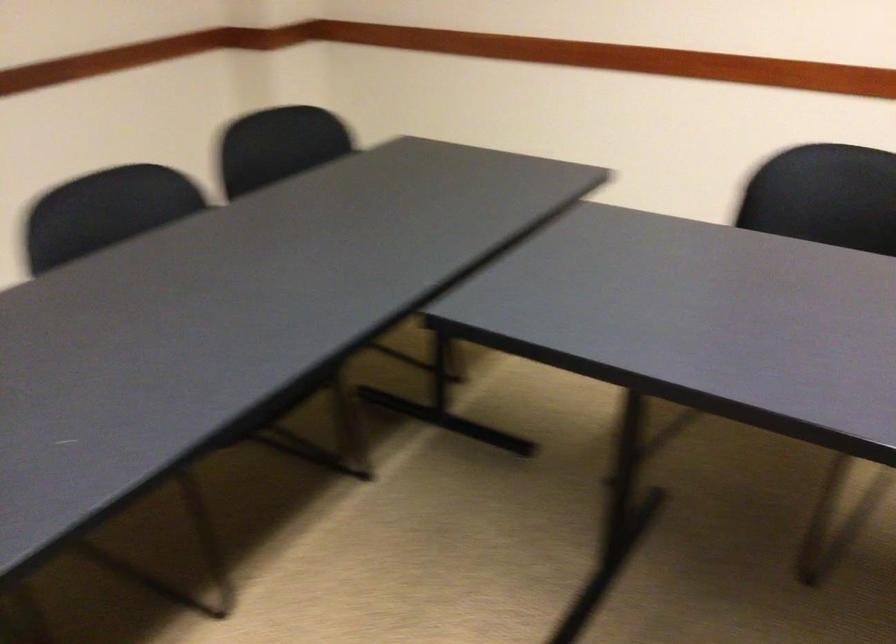
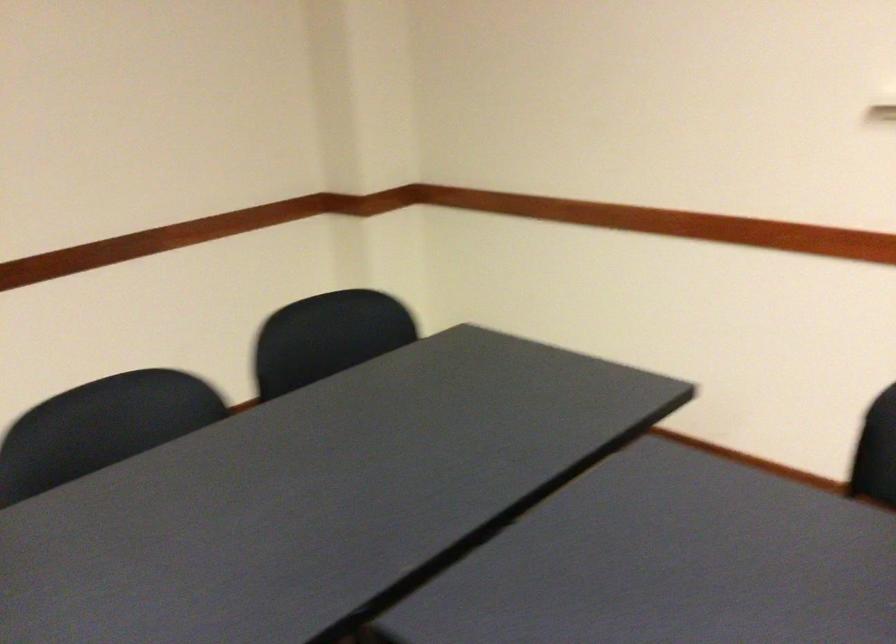
Question: Based on the continuous images, in which direction is the camera rotating? Reply with the corresponding letter.

Choices:
 (A) Left
 (B) Right
 (C) Up
 (D) Down

Answer: (A)